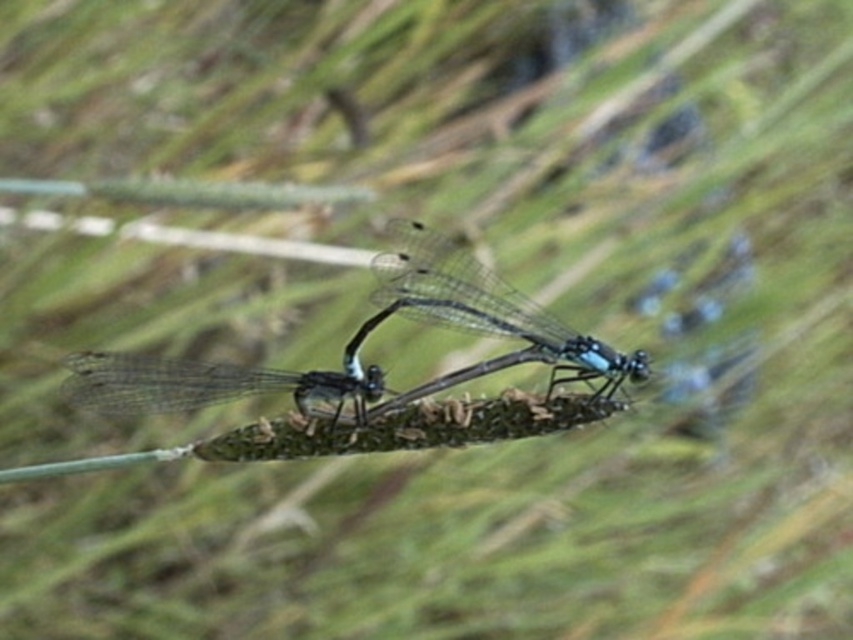
You are a photographer trying to capture the translucent glass dragonfly at center. Based on the scene description, where should you focus your camera to ensure the dragonfly is in sharp focus?

The translucent glass dragonfly at center is located at point (x=485, y=316), so you should focus your camera at that coordinate to ensure it is in sharp focus.

You are an entomologist examining two dragonflies on a stem. You notice that one is a translucent glass dragonfly at center and the other is a transparent glass dragonfly at center. Which dragonfly is closer to you?

The translucent glass dragonfly at center is closer to you because the transparent glass dragonfly at center is positioned behind it.

You are an entomologist examining two dragonflies on a stem. You notice that one is labeled as a translucent glass dragonfly at center and the other as a transparent glass dragonfly at center. Which dragonfly has a larger size?

The translucent glass dragonfly at center is bigger than the transparent glass dragonfly at center, so the translucent one is larger in size.